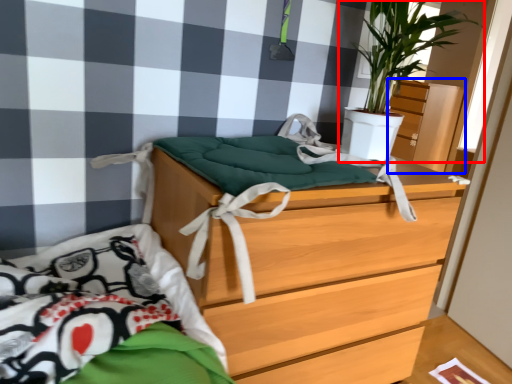
Question: Which object is closer to the camera taking this photo, houseplant (highlighted by a red box) or dresser (highlighted by a blue box)?

Choices:
 (A) houseplant
 (B) dresser

Answer: (A)